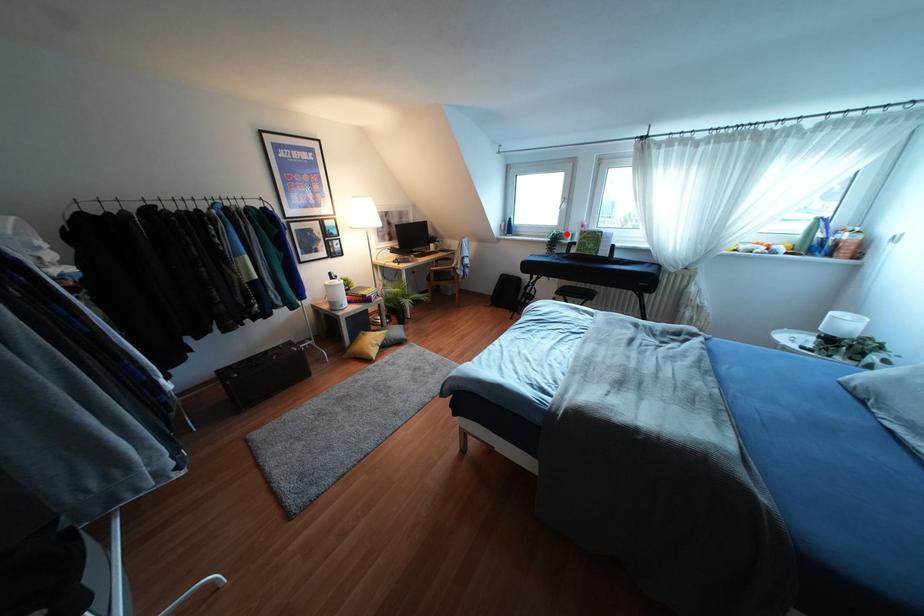
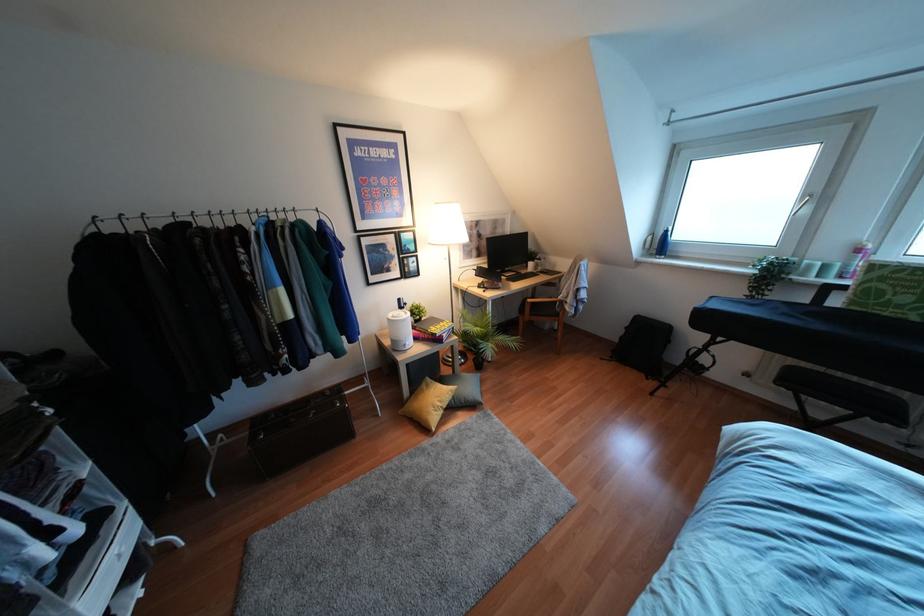
Find the pixel in the second image that matches the highlighted location in the first image.

(809, 265)